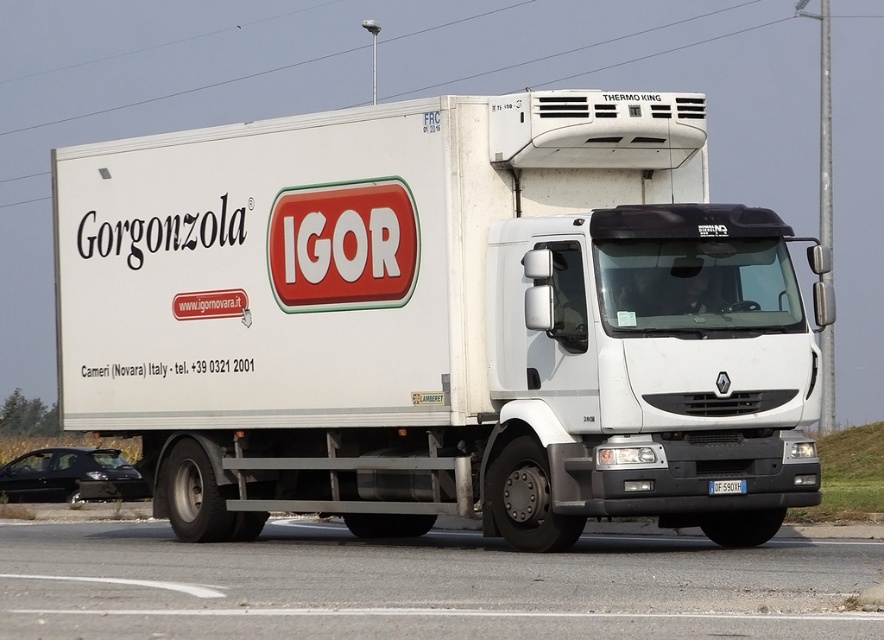
Does white matte trailer truck at center appear on the left side of white plastic license plate at center?

Indeed, white matte trailer truck at center is positioned on the left side of white plastic license plate at center.

Does white matte trailer truck at center appear under white plastic license plate at center?

Incorrect, white matte trailer truck at center is not positioned below white plastic license plate at center.

Find the location of a particular element. white matte trailer truck at center is located at coordinates (437, 321).

You are a GUI agent. You are given a task and a screenshot of the screen. Output one action in this format:
    pyautogui.click(x=<x>, y=<y>)
    Task: Click on the white matte trailer truck at center
    
    Given the screenshot: What is the action you would take?
    pyautogui.click(x=437, y=321)

In the scene shown: Between gray asphalt road at lower center and white plastic license plate at center, which one appears on the right side from the viewer's perspective?

white plastic license plate at center is more to the right.

Image resolution: width=884 pixels, height=640 pixels. What are the coordinates of `gray asphalt road at lower center` in the screenshot? It's located at (423, 586).

Locate an element on the screen. gray asphalt road at lower center is located at coordinates (423, 586).

Who is more forward, (x=523, y=337) or (x=72, y=568)?

Point (x=523, y=337)

Consider the image. Is white matte trailer truck at center positioned behind gray asphalt road at lower center?

Yes, white matte trailer truck at center is behind gray asphalt road at lower center.

Is point (290, 212) closer to viewer compared to point (90, 628)?

No, it is behind (90, 628).

Locate an element on the screen. white matte trailer truck at center is located at coordinates [437, 321].